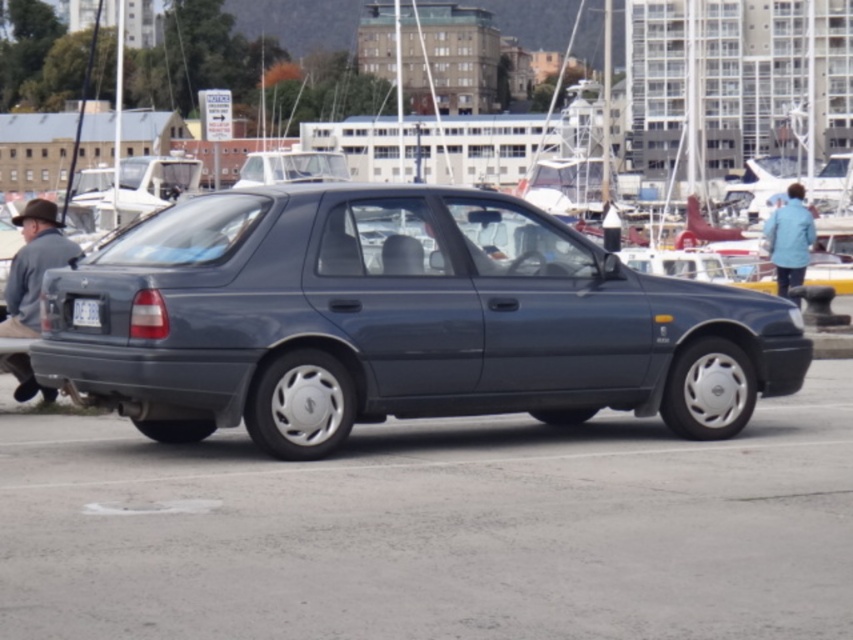
You are a delivery person needing to place a package between the brown fabric hat at left and the light blue fabric jacket at upper right. The package requires a minimum of 30 feet of space. Can you fit it there?

The distance between the brown fabric hat at left and the light blue fabric jacket at upper right is 34.17 feet, which is more than the required 30 feet. Therefore, the package can be placed there.